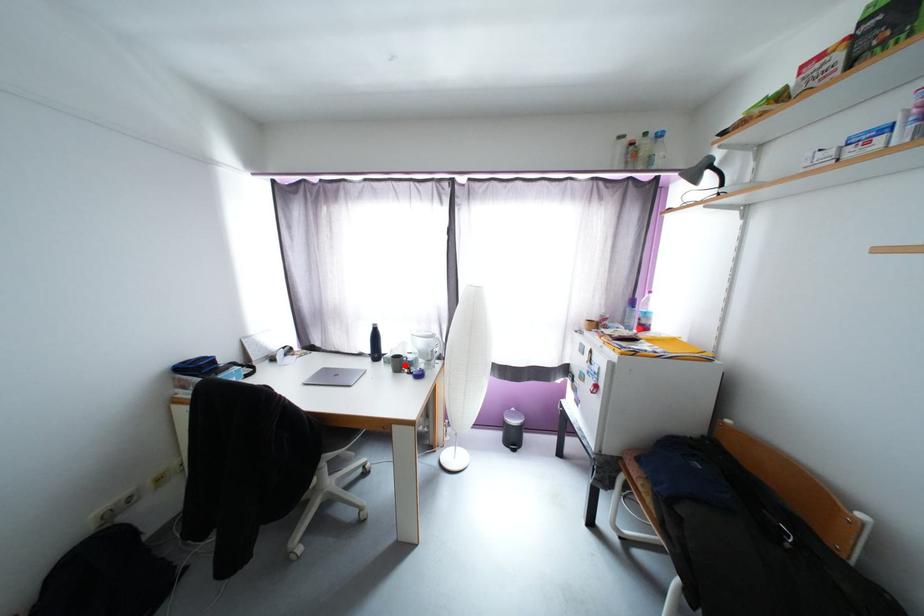
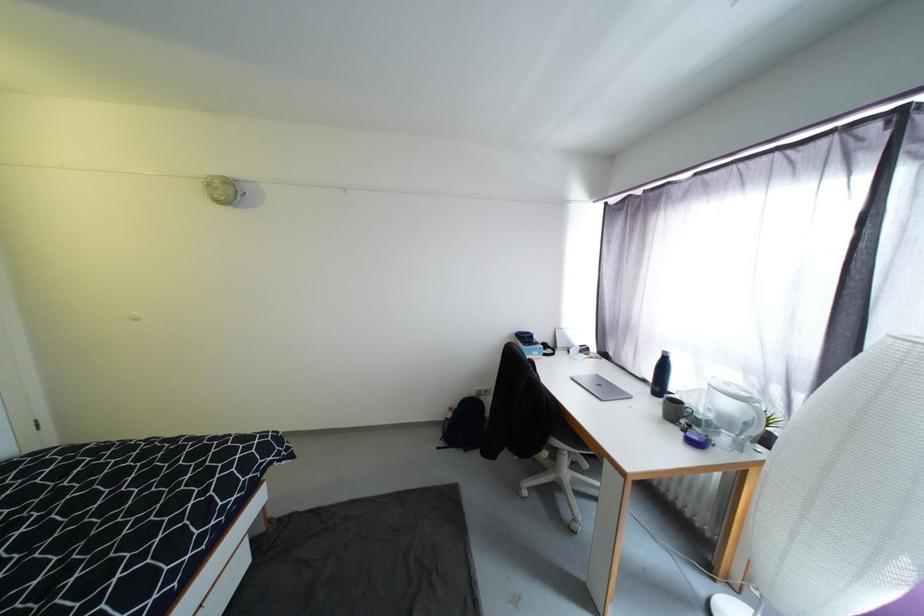
In the second image, find the point that corresponds to the highlighted location in the first image.

(683, 413)